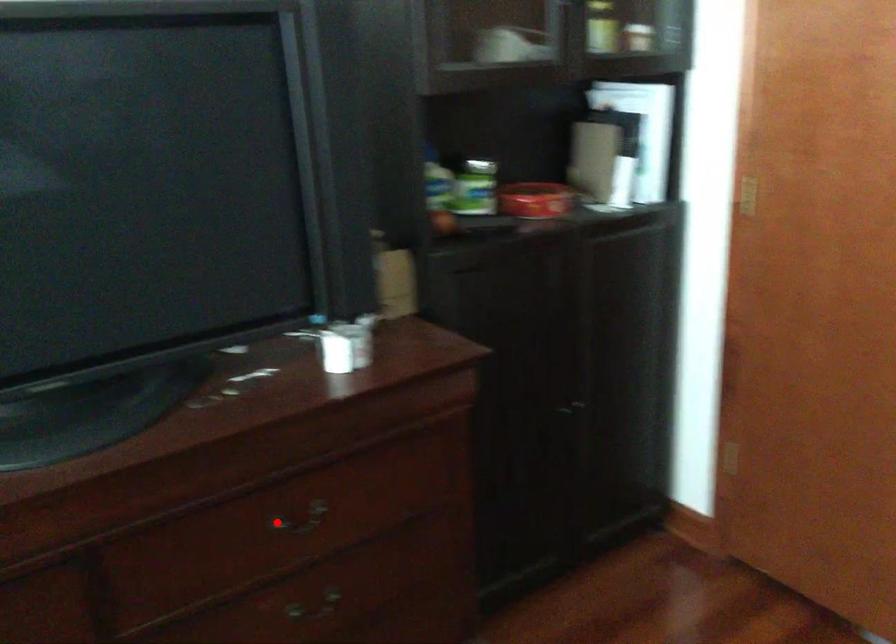
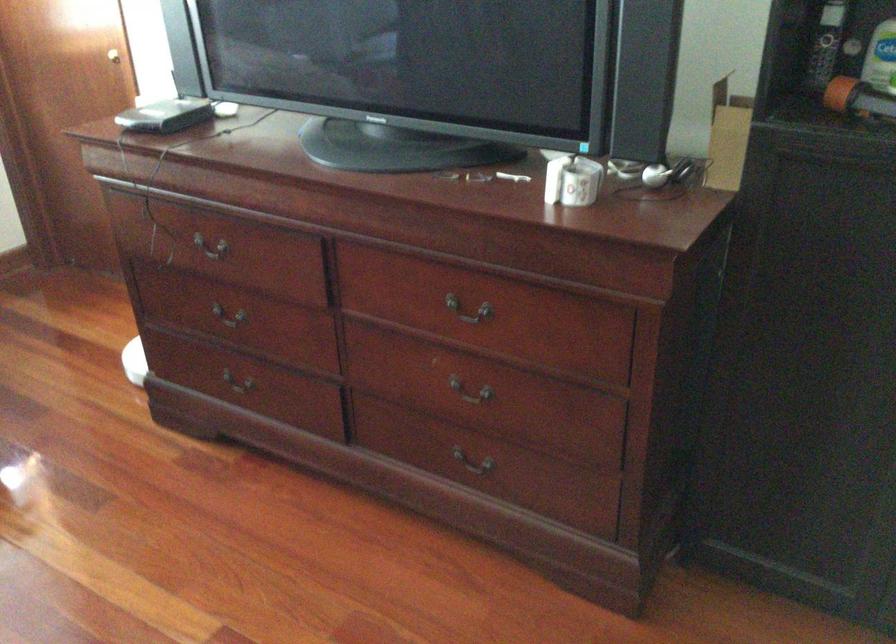
The point at the highlighted location is marked in the first image. Where is the corresponding point in the second image?

(469, 310)